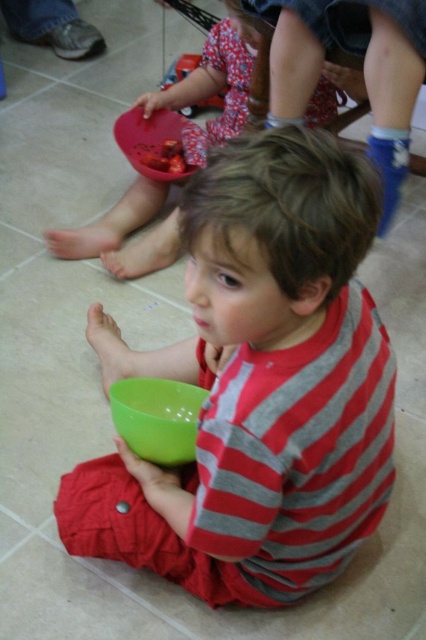
Question: Which point is closer to the camera?

Choices:
 (A) matte plastic bowl at lower center
 (B) rubberized plastic bowl at upper center
 (C) green plastic bowl at lower center
 (D) green plastic bowl at center

Answer: (D)

Question: Does matte plastic bowl at lower center come in front of green plastic bowl at lower center?

Choices:
 (A) no
 (B) yes

Answer: (A)

Question: Among these points, which one is nearest to the camera?

Choices:
 (A) (180, 109)
 (B) (282, 420)
 (C) (204, 136)

Answer: (B)

Question: Which is farther from the matte plastic bowl at lower center?

Choices:
 (A) smooth red food at center
 (B) green plastic bowl at lower center
 (C) green plastic bowl at center
 (D) rubberized plastic bowl at upper center

Answer: (C)

Question: Is matte plastic bowl at lower center closer to the viewer compared to rubberized plastic bowl at upper center?

Choices:
 (A) no
 (B) yes

Answer: (B)

Question: Can you confirm if matte plastic bowl at lower center is positioned to the left of smooth red food at center?

Choices:
 (A) yes
 (B) no

Answer: (B)